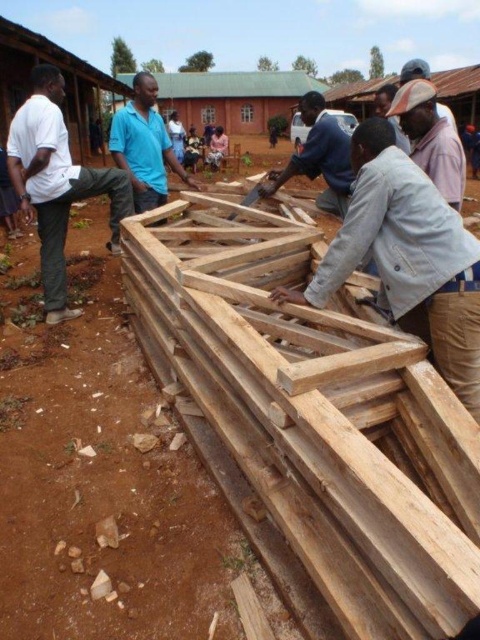
Which is in front, point (402, 200) or point (458, 163)?

Point (402, 200) is in front.

Which is below, light brown wood at center or brown woven hat at upper right?

light brown wood at center is below.

Find the location of `light brown wood at center`. light brown wood at center is located at coordinates (408, 257).

Where is `light brown wood at center`? The width and height of the screenshot is (480, 640). light brown wood at center is located at coordinates (408, 257).

Does light brown wood at center have a lesser width compared to blue smooth shirt at center?

Indeed, light brown wood at center has a lesser width compared to blue smooth shirt at center.

Describe the element at coordinates (408, 257) in the screenshot. I see `light brown wood at center` at that location.

Who is more distant from viewer, (425, 289) or (145, 92)?

The point (145, 92) is more distant.

Image resolution: width=480 pixels, height=640 pixels. In order to click on light brown wood at center in this screenshot , I will do (408, 257).

Is point (165, 202) in front of point (408, 109)?

No, it is behind (408, 109).

Between blue smooth shirt at center and brown woven hat at upper right, which one is positioned lower?

brown woven hat at upper right is lower down.

Find the location of a particular element. The width and height of the screenshot is (480, 640). blue smooth shirt at center is located at coordinates (144, 145).

Locate an element on the screen. The width and height of the screenshot is (480, 640). blue smooth shirt at center is located at coordinates (144, 145).